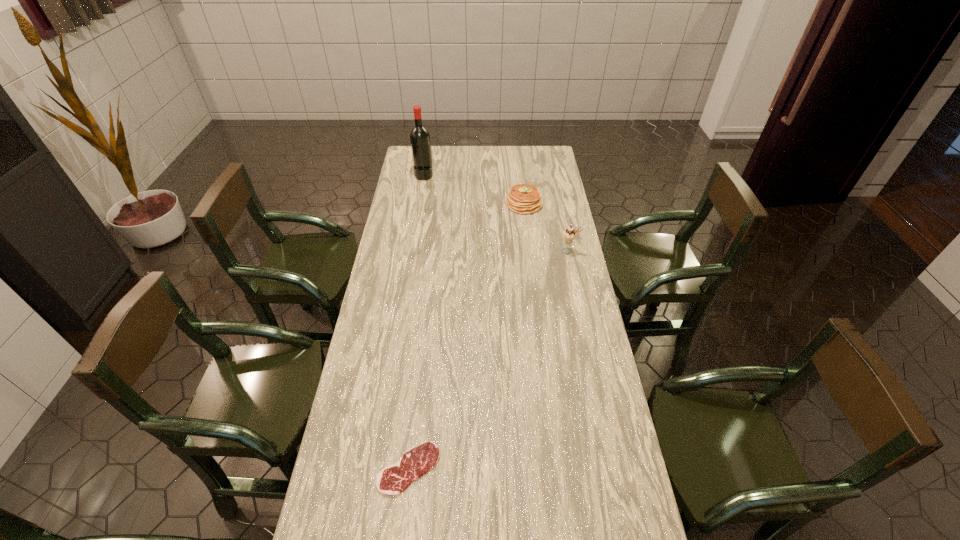
Identify the location of free space located on the back of the third tallest object. (518, 156).

At what (x,y) coordinates should I click in order to perform the action: click on vacant area situated 0.380m on the back of the shortest object. Please return your answer as a coordinate pair (x, y). Image resolution: width=960 pixels, height=540 pixels. Looking at the image, I should click on (424, 335).

Find the location of a particular element. The image size is (960, 540). object that is at the far edge is located at coordinates (420, 140).

I want to click on wine bottle that is at the left edge, so click(x=420, y=140).

I want to click on steak that is at the left edge, so click(392, 480).

Where is `icecream at the right edge`? icecream at the right edge is located at coordinates (569, 234).

The image size is (960, 540). In order to click on pancake situated at the right edge in this screenshot , I will do `click(522, 198)`.

The image size is (960, 540). What are the coordinates of `object located at the far left corner` in the screenshot? It's located at (420, 140).

This screenshot has height=540, width=960. In order to click on vacant space at the far edge of the desktop in this screenshot , I will do `click(509, 163)`.

In the image, there is a desktop. Where is `free space at the left edge`? This screenshot has height=540, width=960. free space at the left edge is located at coordinates (399, 181).